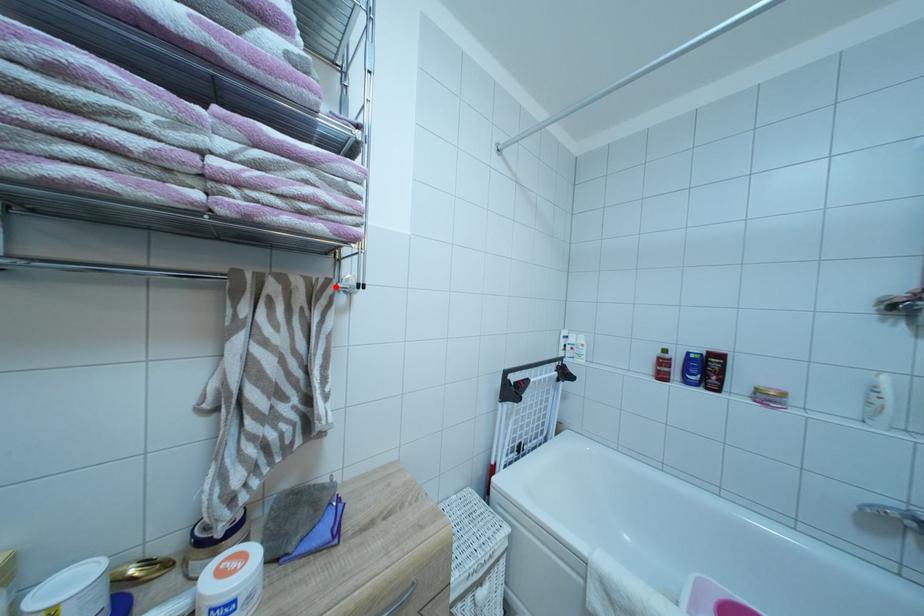
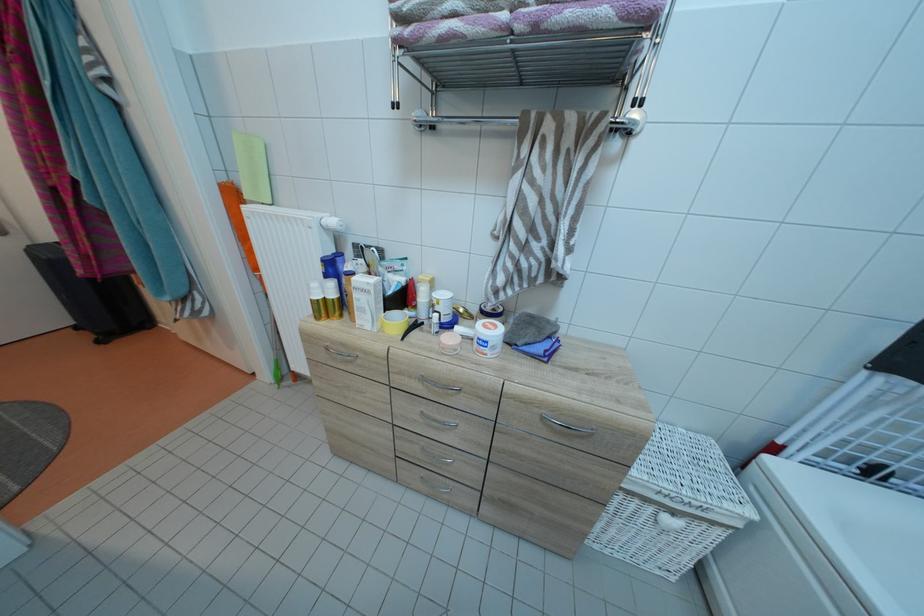
Find the pixel in the second image that matches the highlighted location in the first image.

(611, 120)